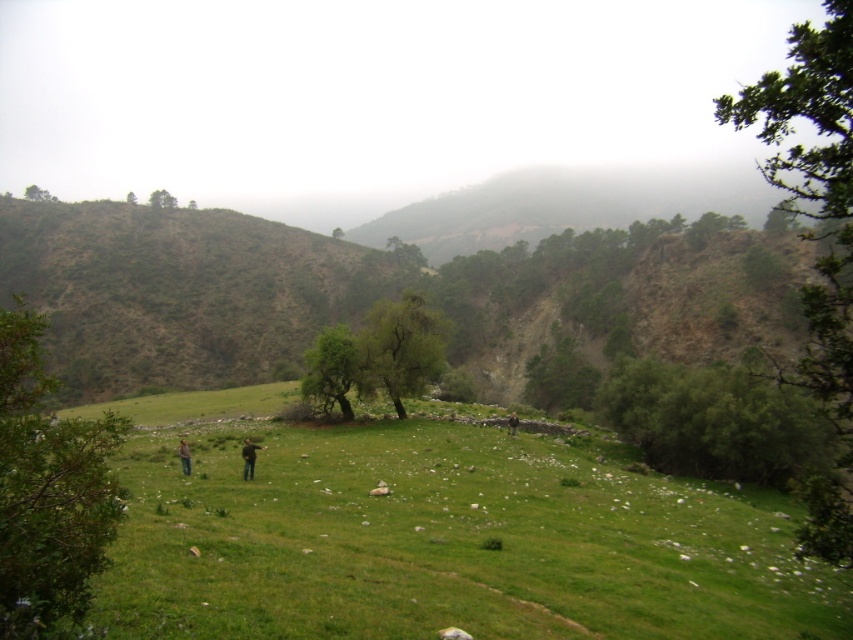
Does point (437, 364) come closer to viewer compared to point (160, 202)?

Yes, point (437, 364) is in front of point (160, 202).

What do you see at coordinates (399, 349) in the screenshot? This screenshot has width=853, height=640. I see `green leafy tree at center` at bounding box center [399, 349].

You are a GUI agent. You are given a task and a screenshot of the screen. Output one action in this format:
    pyautogui.click(x=<x>, y=<y>)
    Task: Click on the green leafy tree at center
    The image size is (853, 640).
    Given the screenshot: What is the action you would take?
    pyautogui.click(x=399, y=349)

Between green grass at center and green leafy tree at lower left, which one is positioned lower?

green grass at center is below.

Based on the photo, can you confirm if green grass at center is taller than green leafy tree at lower left?

Incorrect, green grass at center's height is not larger of green leafy tree at lower left's.

Identify the location of green grass at center. Image resolution: width=853 pixels, height=640 pixels. (436, 536).

How much distance is there between green leafy tree at right and green leafy tree at upper center?

A distance of 220.00 meters exists between green leafy tree at right and green leafy tree at upper center.

Who is lower down, green leafy tree at right or green leafy tree at upper center?

green leafy tree at upper center is below.

Between point (825, 218) and point (160, 193), which one is positioned in front?

Positioned in front is point (825, 218).

At what (x,y) coordinates should I click in order to perform the action: click on green leafy tree at right. Please return your answer as a coordinate pair (x, y). Image resolution: width=853 pixels, height=640 pixels. Looking at the image, I should click on (816, 241).